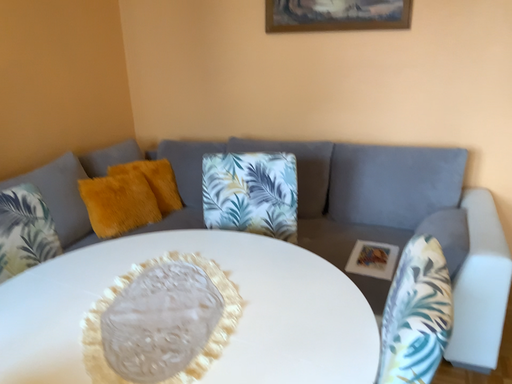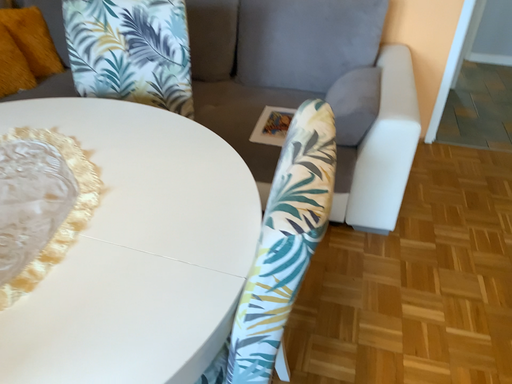
Question: How did the camera likely rotate when shooting the video?

Choices:
 (A) rotated left
 (B) rotated right

Answer: (B)